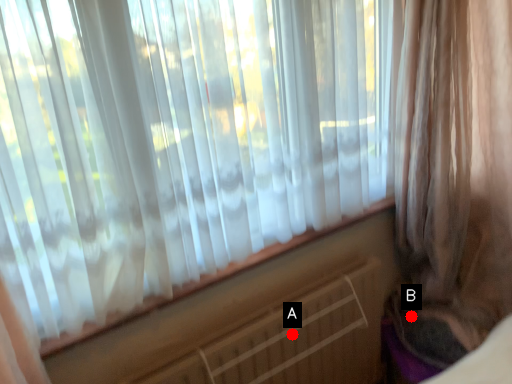
Question: Two points are circled on the image, labeled by A and B beside each circle. Which point appears closest to the camera in this image?

Choices:
 (A) A is closer
 (B) B is closer

Answer: (A)